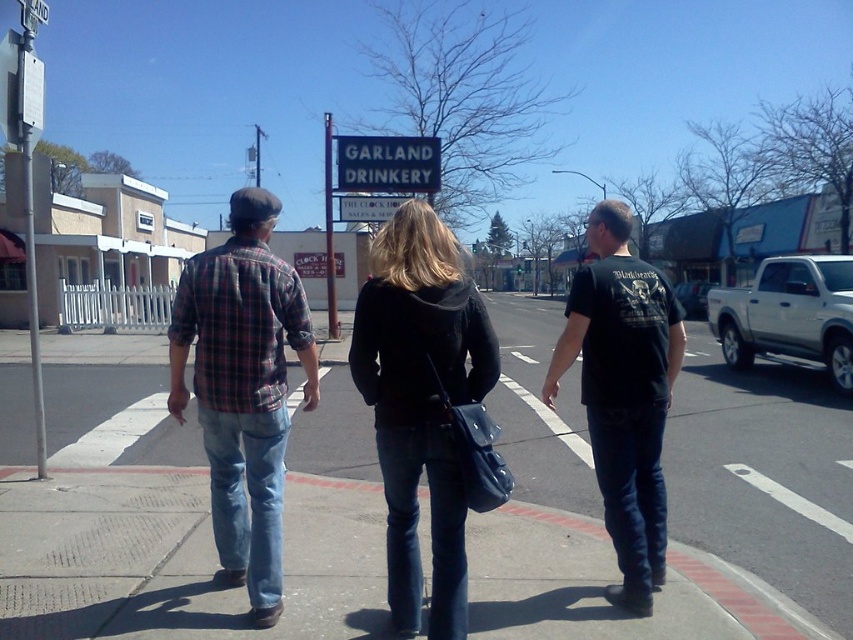
Looking at this image, does plaid shirt at center lie in front of white matte truck at center-right?

No, plaid shirt at center is further to the viewer.

Who is more forward, (x=462, y=330) or (x=689, y=284)?

Point (x=462, y=330) is in front.

Locate an element on the screen. Image resolution: width=853 pixels, height=640 pixels. plaid shirt at center is located at coordinates (421, 403).

Does smooth concrete sidewalk at center have a lesser width compared to white matte truck at center-right?

In fact, smooth concrete sidewalk at center might be wider than white matte truck at center-right.

Does smooth concrete sidewalk at center appear on the left side of white matte truck at center-right?

Yes, smooth concrete sidewalk at center is to the left of white matte truck at center-right.

The height and width of the screenshot is (640, 853). Identify the location of smooth concrete sidewalk at center. (669, 502).

Between smooth concrete sidewalk at center and plaid shirt at center, which one has less height?

Standing shorter between the two is plaid shirt at center.

Which is behind, point (55, 349) or point (422, 392)?

The point (55, 349) is more distant.

What are the coordinates of `smooth concrete sidewalk at center` in the screenshot? It's located at (669, 502).